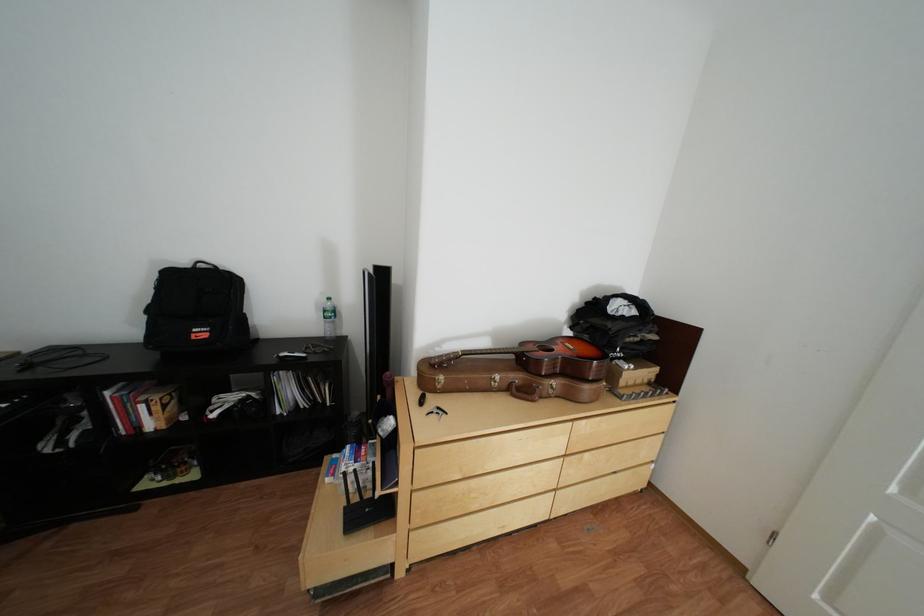
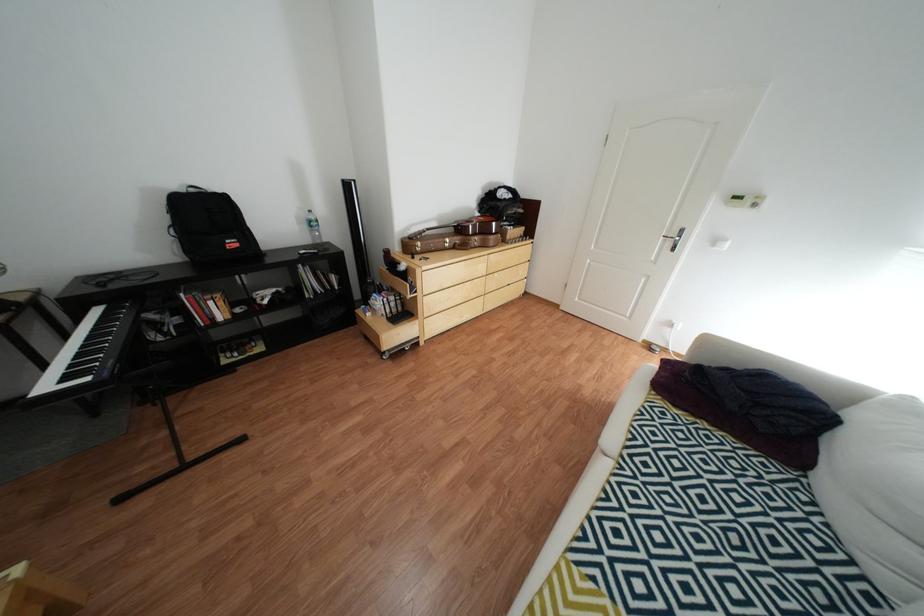
What movement of the cameraman would produce the second image?

The cameraman walked toward left, backward.